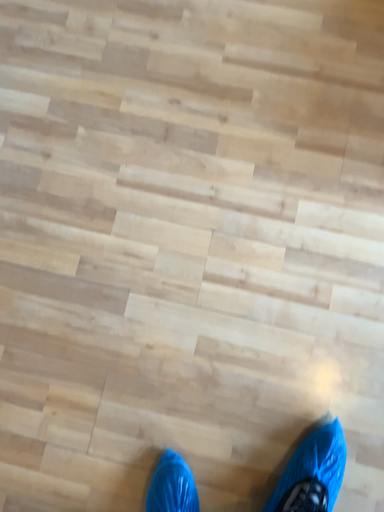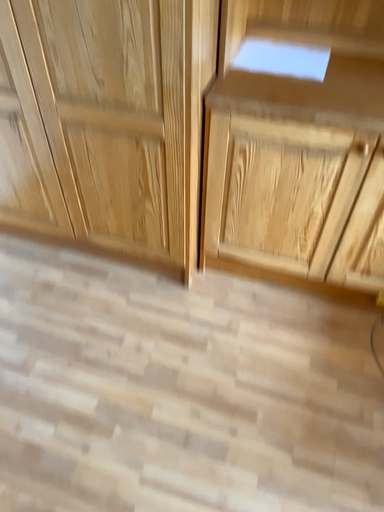
Question: How did the camera likely rotate when shooting the video?

Choices:
 (A) rotated upward
 (B) rotated downward

Answer: (A)